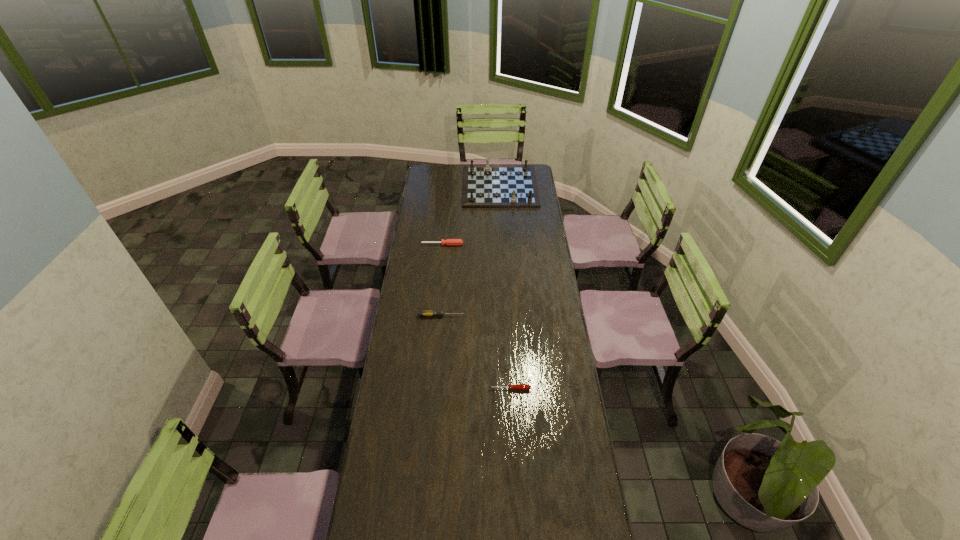
Where is `the farthest object`? the farthest object is located at coordinates (484, 186).

Where is `the tallest object`? The height and width of the screenshot is (540, 960). the tallest object is located at coordinates (484, 186).

Locate an element on the screen. This screenshot has width=960, height=540. the farthest screwdriver is located at coordinates (449, 241).

Locate an element on the screen. This screenshot has height=540, width=960. the second farthest screwdriver is located at coordinates coord(422,313).

This screenshot has width=960, height=540. Identify the location of the nearest screwdriver. (519, 386).

Where is `the rightmost screwdriver`? The width and height of the screenshot is (960, 540). the rightmost screwdriver is located at coordinates (519, 386).

I want to click on vacant space positioned 0.060m on the board of the chessboard, so click(x=502, y=214).

Locate an element on the screen. The width and height of the screenshot is (960, 540). free spot located 0.350m on the right of the third nearest object is located at coordinates (530, 245).

I want to click on blank area located 0.090m insert the second nearest screwdriver into a screw head, so click(x=484, y=316).

Identify the location of free space located 0.270m on the front of the rightmost screwdriver. coord(514,462).